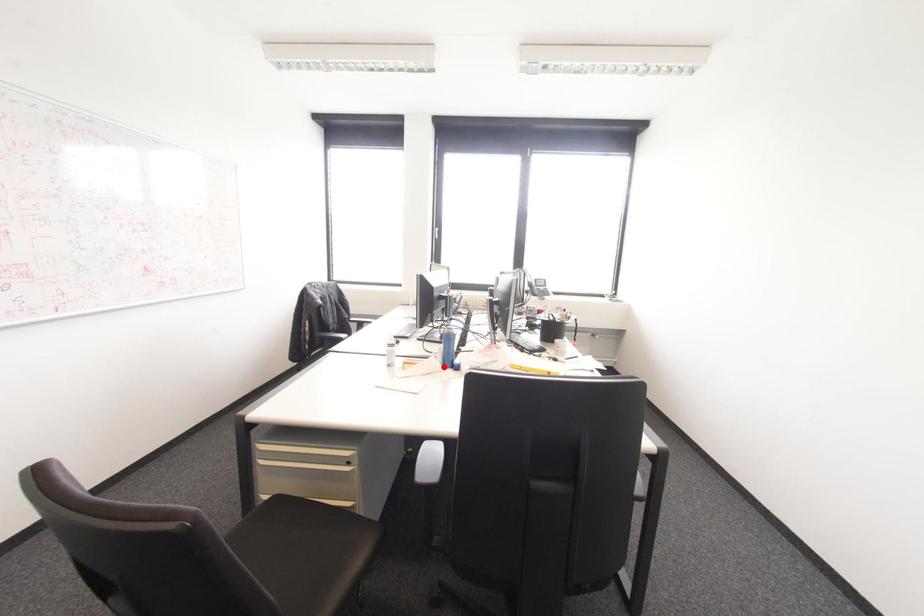
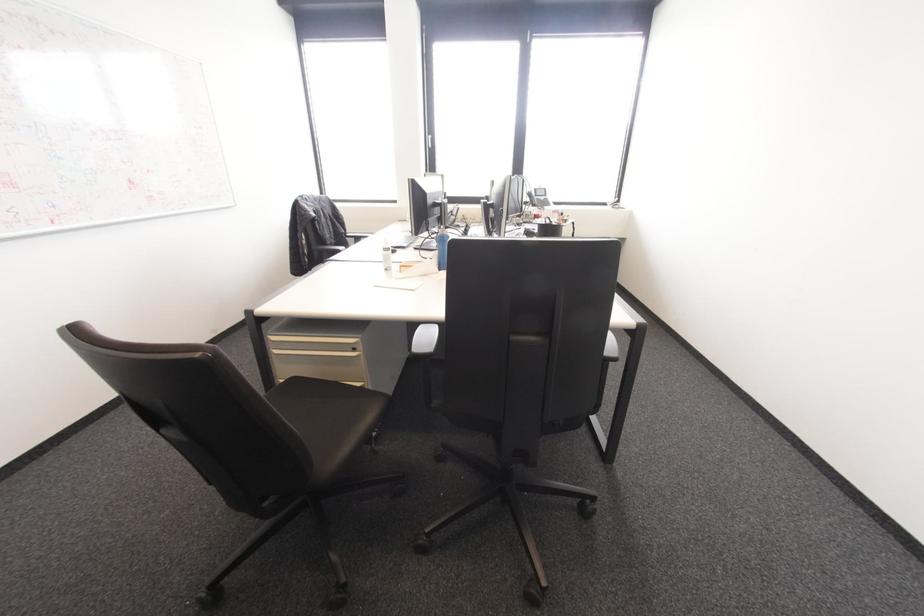
Question: A red point is marked in image1. In image2, is the corresponding 3D point closer to the camera or farther? Reply with the corresponding letter.

Choices:
 (A) The corresponding 3D point is closer.
 (B) The corresponding 3D point is farther.

Answer: (A)